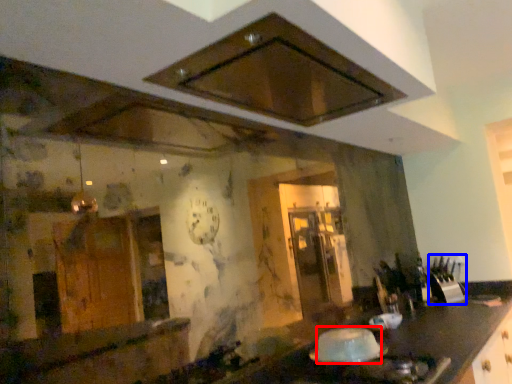
Question: Which object is further to the camera taking this photo, food (highlighted by a red box) or appliance (highlighted by a blue box)?

Choices:
 (A) food
 (B) appliance

Answer: (B)